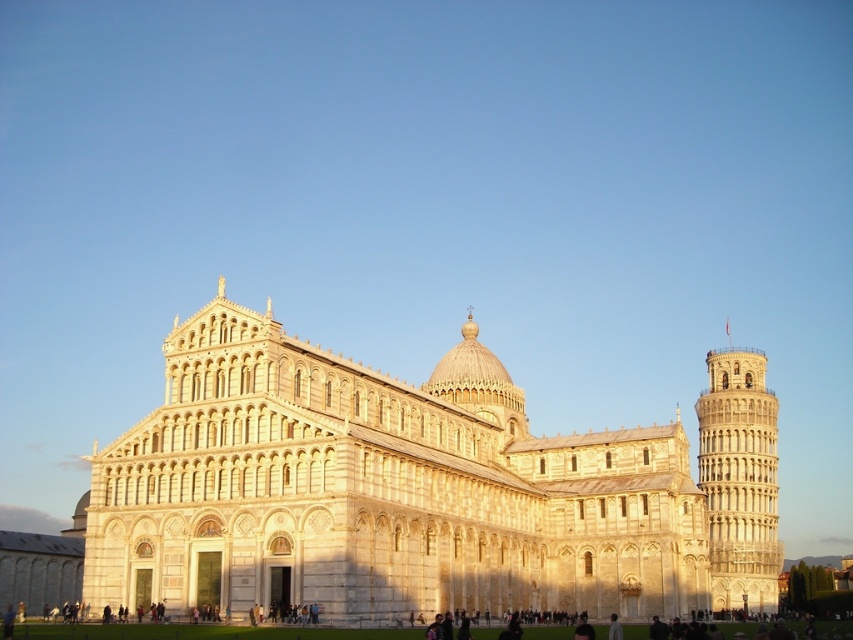
Question: Is white stone cathedral at center above white stone tower at right?

Choices:
 (A) no
 (B) yes

Answer: (B)

Question: Which object appears closest to the camera in this image?

Choices:
 (A) white stone cathedral at center
 (B) white stone tower at right

Answer: (A)

Question: Among these objects, which one is farthest from the camera?

Choices:
 (A) white stone tower at right
 (B) white stone cathedral at center

Answer: (A)

Question: Does white stone cathedral at center appear under white stone tower at right?

Choices:
 (A) no
 (B) yes

Answer: (A)

Question: Is the position of white stone cathedral at center more distant than that of white stone tower at right?

Choices:
 (A) no
 (B) yes

Answer: (A)

Question: Which object is farther from the camera taking this photo?

Choices:
 (A) white stone cathedral at center
 (B) white stone tower at right

Answer: (B)